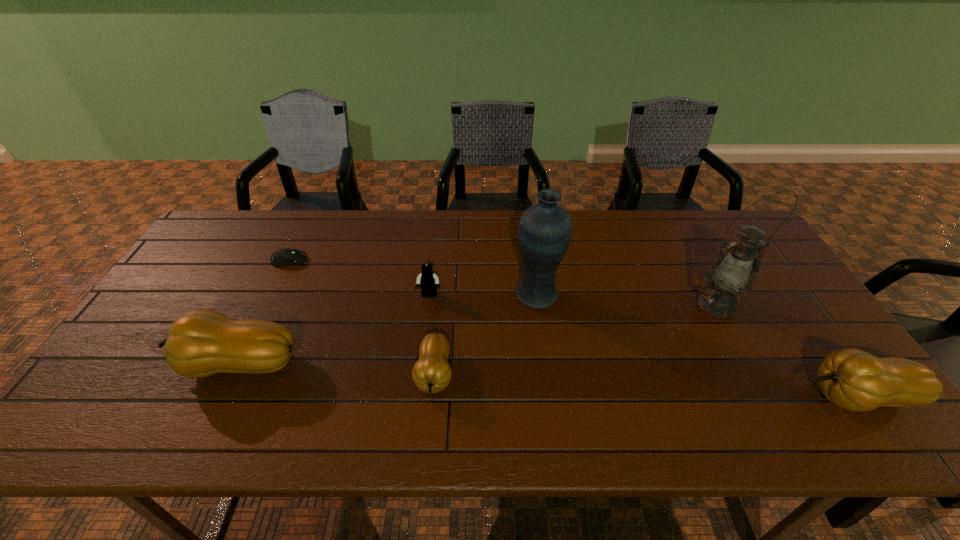
To achieve even spacing by inserting another gourd among them, please point to a vacant spot for this new gourd. Please provide its 2D coordinates. Your answer should be formatted as a tuple, i.e. [(x, y)], where the tuple contains the x and y coordinates of a point satisfying the conditions above.

[(641, 386)]